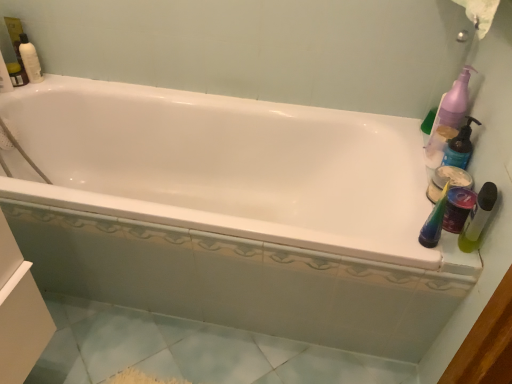
Question: Is white glossy bathtub at center beside matte white container at right, arranged as the 1th cleaning product when ordered from the bottom?

Choices:
 (A) no
 (B) yes

Answer: (A)

Question: Could you tell me if white glossy bathtub at center is turned towards matte white container at right, arranged as the 1th cleaning product when ordered from the bottom?

Choices:
 (A) yes
 (B) no

Answer: (B)

Question: Does white glossy bathtub at center have a larger size compared to matte white container at right, arranged as the 1th cleaning product when ordered from the bottom?

Choices:
 (A) no
 (B) yes

Answer: (B)

Question: Can you confirm if white glossy bathtub at center is thinner than matte white container at right, which is the second cleaning product from top to bottom?

Choices:
 (A) yes
 (B) no

Answer: (B)

Question: Does white glossy bathtub at center have a greater width compared to matte white container at right, which is the second cleaning product from top to bottom?

Choices:
 (A) yes
 (B) no

Answer: (A)

Question: Is point (300, 259) closer or farther from the camera than point (471, 241)?

Choices:
 (A) farther
 (B) closer

Answer: (A)

Question: Based on their positions, is white glossy bathtub at center located to the left or right of green matte bottle at right, marked as the 2th mouthwash in a back-to-front arrangement?

Choices:
 (A) left
 (B) right

Answer: (A)

Question: Looking at their shapes, would you say white glossy bathtub at center is wider or thinner than green matte bottle at right, marked as the 2th mouthwash in a back-to-front arrangement?

Choices:
 (A) wide
 (B) thin

Answer: (A)

Question: From the image's perspective, is white glossy bathtub at center above or below green matte bottle at right, marked as the 2th mouthwash in a back-to-front arrangement?

Choices:
 (A) above
 (B) below

Answer: (A)

Question: Based on their positions, is green matte bottle at right, the 2th mouthwash viewed from the front, located to the left or right of green matte bottle at right, marked as the 2th mouthwash in a back-to-front arrangement?

Choices:
 (A) left
 (B) right

Answer: (B)

Question: Relative to green matte bottle at right, marked as the 2th mouthwash in a back-to-front arrangement, is green matte bottle at right, the 1th mouthwash positioned from the back, in front or behind?

Choices:
 (A) behind
 (B) front

Answer: (A)

Question: Is green matte bottle at right, the 1th mouthwash positioned from the back, inside the boundaries of green matte bottle at right, marked as the 2th mouthwash in a back-to-front arrangement, or outside?

Choices:
 (A) outside
 (B) inside

Answer: (A)

Question: Is point (443, 165) positioned closer to the camera than point (460, 238)?

Choices:
 (A) closer
 (B) farther

Answer: (B)

Question: In terms of height, does matte white container at right, which is the second cleaning product from top to bottom, look taller or shorter compared to purple plastic pump bottle at upper right, which is counted as the 2th cleaning product, starting from the bottom?

Choices:
 (A) tall
 (B) short

Answer: (B)

Question: In terms of size, does matte white container at right, which is the second cleaning product from top to bottom, appear bigger or smaller than purple plastic pump bottle at upper right, arranged as the first cleaning product when viewed from the top?

Choices:
 (A) big
 (B) small

Answer: (B)